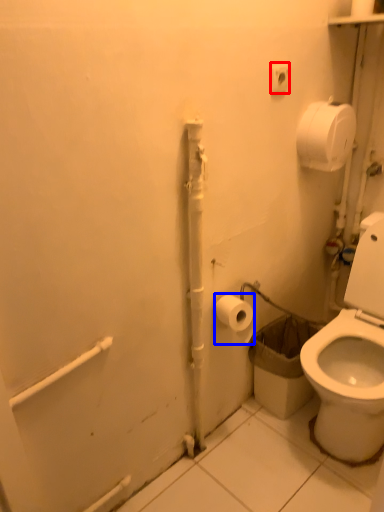
Question: Among these objects, which one is nearest to the camera, electric outlet (highlighted by a red box) or toilet paper (highlighted by a blue box)?

Choices:
 (A) electric outlet
 (B) toilet paper

Answer: (A)